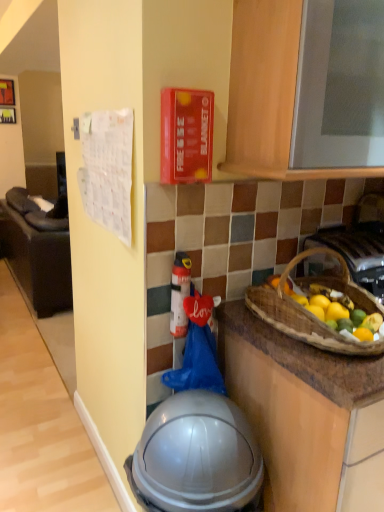
Question: From their relative heights in the image, would you say white fabric calendar at left is taller or shorter than metallic silver gas stove at right?

Choices:
 (A) short
 (B) tall

Answer: (B)

Question: In terms of width, does white fabric calendar at left look wider or thinner when compared to metallic silver gas stove at right?

Choices:
 (A) wide
 (B) thin

Answer: (A)

Question: Based on their relative distances, which object is farther from the metallic silver gas stove at right?

Choices:
 (A) transparent plastic helmet at lower center
 (B) wooden cabinet at upper center
 (C) brown woven basket at right
 (D) white fabric calendar at left

Answer: (D)

Question: Which is farther from the wooden cabinet at upper center?

Choices:
 (A) white fabric calendar at left
 (B) metallic silver gas stove at right
 (C) transparent plastic helmet at lower center
 (D) brown woven basket at right

Answer: (A)